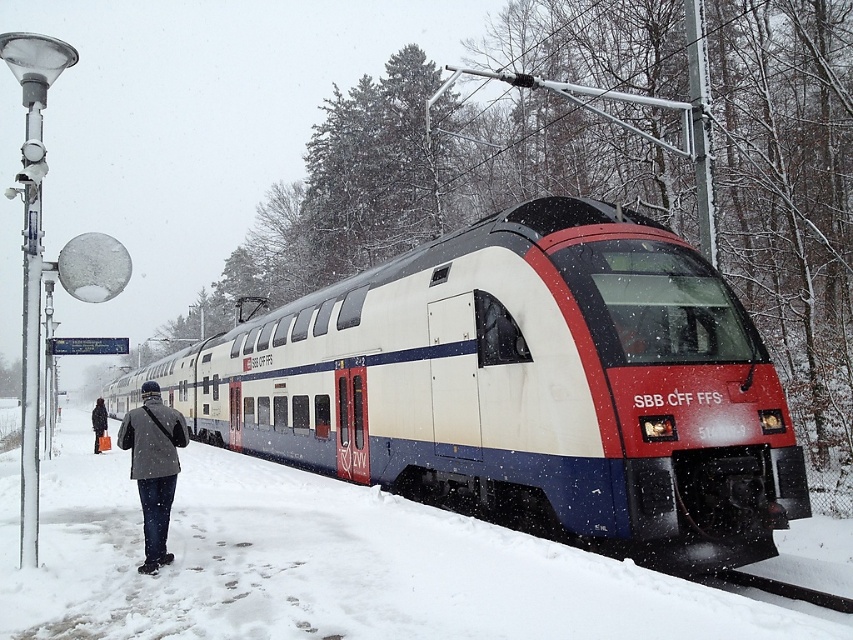
Does white glossy train at center lie in front of dark gray wool coat at left?

Yes, white glossy train at center is closer to the viewer.

Which is above, white glossy train at center or dark gray wool coat at left?

white glossy train at center

This screenshot has width=853, height=640. Describe the element at coordinates (521, 387) in the screenshot. I see `white glossy train at center` at that location.

This screenshot has width=853, height=640. Find the location of `white glossy train at center`. white glossy train at center is located at coordinates (521, 387).

Does white glossy train at center appear under gray woolen coat at left?

Yes.

Can you confirm if white glossy train at center is smaller than gray woolen coat at left?

Incorrect, white glossy train at center is not smaller in size than gray woolen coat at left.

Is point (445, 289) positioned after point (142, 500)?

That is True.

Where is `white glossy train at center`? white glossy train at center is located at coordinates (521, 387).

Can you confirm if gray woolen coat at left is bigger than dark gray wool coat at left?

No, gray woolen coat at left is not bigger than dark gray wool coat at left.

Between gray woolen coat at left and dark gray wool coat at left, which one has less height?

With less height is gray woolen coat at left.

Does point (160, 493) come farther from viewer compared to point (97, 406)?

No, (160, 493) is in front of (97, 406).

Identify the location of gray woolen coat at left. This screenshot has width=853, height=640. (154, 467).